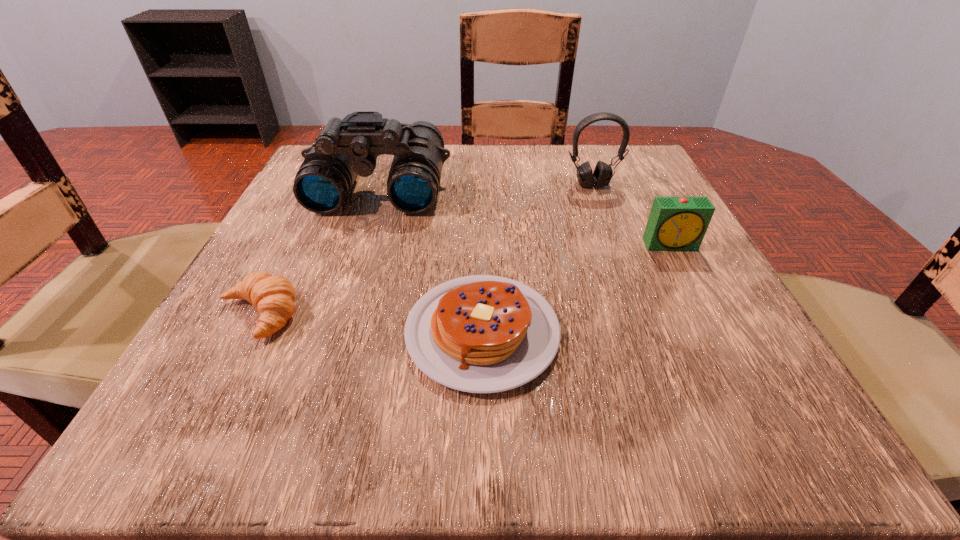
The height and width of the screenshot is (540, 960). In the image, there is a desktop. What are the coordinates of `vacant area at the far edge` in the screenshot? It's located at (476, 181).

The height and width of the screenshot is (540, 960). In the image, there is a desktop. Identify the location of vacant space at the near edge. (422, 438).

In the image, there is a desktop. At what (x,y) coordinates should I click in order to perform the action: click on vacant space at the left edge. Please return your answer as a coordinate pair (x, y). The height and width of the screenshot is (540, 960). Looking at the image, I should click on (216, 346).

The height and width of the screenshot is (540, 960). I want to click on vacant space at the right edge of the desktop, so click(x=761, y=350).

Locate an element on the screen. The height and width of the screenshot is (540, 960). free space at the near left corner is located at coordinates (214, 444).

The image size is (960, 540). I want to click on vacant area at the far right corner, so click(x=657, y=170).

Find the location of a particular element. This screenshot has height=540, width=960. free region at the near right corner of the desktop is located at coordinates (670, 398).

Locate an element on the screen. free space between the third shortest object and the binoculars is located at coordinates (525, 215).

You are a GUI agent. You are given a task and a screenshot of the screen. Output one action in this format:
    pyautogui.click(x=<x>, y=<y>)
    Task: Click on the free space between the alarm clock and the headset
    
    Given the screenshot: What is the action you would take?
    pyautogui.click(x=632, y=215)

This screenshot has width=960, height=540. Find the location of `free space between the pancake and the headset`. free space between the pancake and the headset is located at coordinates (538, 259).